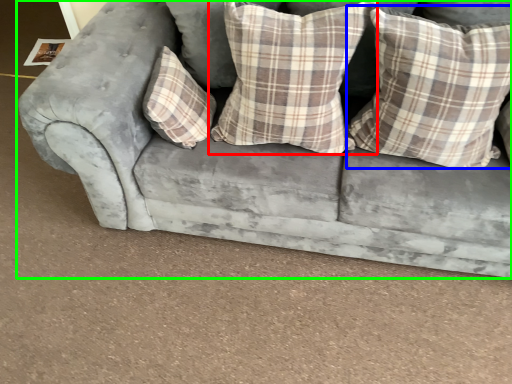
Question: Estimate the real-world distances between objects in this image. Which object is farther from pillow (highlighted by a red box), pillow (highlighted by a blue box) or studio couch (highlighted by a green box)?

Choices:
 (A) pillow
 (B) studio couch

Answer: (B)